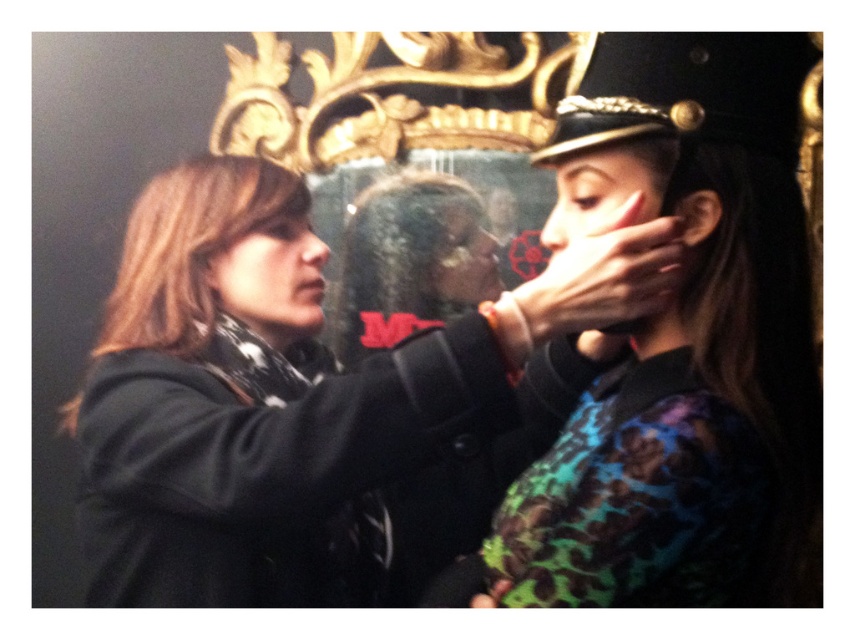
This screenshot has width=855, height=640. Describe the element at coordinates (682, 349) in the screenshot. I see `shiny black hat at upper right` at that location.

Can you confirm if shiny black hat at upper right is smaller than matte black scarf at left?

Actually, shiny black hat at upper right might be larger than matte black scarf at left.

This screenshot has width=855, height=640. What do you see at coordinates (682, 349) in the screenshot? I see `shiny black hat at upper right` at bounding box center [682, 349].

The height and width of the screenshot is (640, 855). I want to click on shiny black hat at upper right, so click(682, 349).

Can you confirm if matte black jacket at center is smaller than matte black hat at upper center?

Incorrect, matte black jacket at center is not smaller in size than matte black hat at upper center.

Which is in front, point (476, 376) or point (681, 160)?

Point (476, 376) is more forward.

What do you see at coordinates (310, 401) in the screenshot? I see `matte black jacket at center` at bounding box center [310, 401].

This screenshot has width=855, height=640. In order to click on matte black jacket at center in this screenshot , I will do `click(310, 401)`.

Looking at this image, can you confirm if matte black face at upper right is positioned to the right of matte black hat at upper center?

In fact, matte black face at upper right is to the left of matte black hat at upper center.

Which of these two, matte black face at upper right or matte black hat at upper center, stands taller?

matte black face at upper right is taller.

Does point (640, 211) lie behind point (684, 154)?

Yes, it is.

Where is `matte black face at upper right`? The image size is (855, 640). matte black face at upper right is located at coordinates (604, 192).